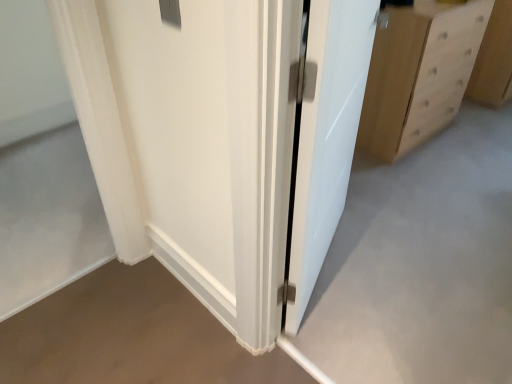
Question: Based on their positions, is white glossy door at center located to the left or right of light brown wood chest of drawers at right?

Choices:
 (A) right
 (B) left

Answer: (B)

Question: Considering the positions of white glossy door at center and light brown wood chest of drawers at right in the image, is white glossy door at center wider or thinner than light brown wood chest of drawers at right?

Choices:
 (A) thin
 (B) wide

Answer: (A)

Question: Which object is the closest to the light wood drawer at right?

Choices:
 (A) white sheer curtain at left
 (B) white glossy door at center
 (C) light brown wood chest of drawers at right

Answer: (C)

Question: Considering the real-world distances, which object is closest to the light brown wood chest of drawers at right?

Choices:
 (A) light wood drawer at right
 (B) white sheer curtain at left
 (C) white glossy door at center

Answer: (A)